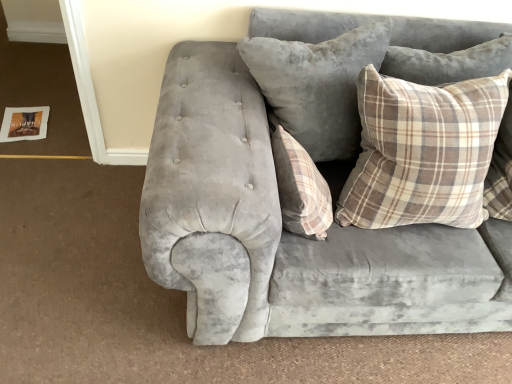
Question: Is plaid fabric pillow at upper right, positioned as the first pillow in right-to-left order, to the right of velvet gray pillow at center, positioned as the second pillow in right-to-left order, from the viewer's perspective?

Choices:
 (A) yes
 (B) no

Answer: (A)

Question: Does plaid fabric pillow at upper right, positioned as the first pillow in right-to-left order, have a greater height compared to velvet gray pillow at center, which appears as the 2th pillow when viewed from the left?

Choices:
 (A) no
 (B) yes

Answer: (A)

Question: Is plaid fabric pillow at upper right, positioned as the first pillow in right-to-left order, turned away from velvet gray pillow at center, which appears as the 2th pillow when viewed from the left?

Choices:
 (A) yes
 (B) no

Answer: (B)

Question: Considering the relative positions of plaid fabric pillow at upper right, positioned as the first pillow in right-to-left order, and velvet gray pillow at center, positioned as the second pillow in right-to-left order, in the image provided, is plaid fabric pillow at upper right, positioned as the first pillow in right-to-left order, in front of velvet gray pillow at center, positioned as the second pillow in right-to-left order,?

Choices:
 (A) yes
 (B) no

Answer: (A)

Question: Is the depth of plaid fabric pillow at upper right, positioned as the first pillow in right-to-left order, greater than that of velvet gray pillow at center, positioned as the second pillow in right-to-left order?

Choices:
 (A) no
 (B) yes

Answer: (A)

Question: Is plaid fabric pillow at center, acting as the 1th pillow starting from the left, spatially inside velvet gray couch at center, or outside of it?

Choices:
 (A) inside
 (B) outside

Answer: (A)

Question: Based on their sizes in the image, would you say plaid fabric pillow at center, acting as the 1th pillow starting from the left, is bigger or smaller than velvet gray couch at center?

Choices:
 (A) small
 (B) big

Answer: (A)

Question: Considering their positions, is plaid fabric pillow at center, marked as the 3th pillow in a right-to-left arrangement, located in front of or behind velvet gray couch at center?

Choices:
 (A) behind
 (B) front

Answer: (A)

Question: In terms of width, does plaid fabric pillow at center, marked as the 3th pillow in a right-to-left arrangement, look wider or thinner when compared to velvet gray couch at center?

Choices:
 (A) thin
 (B) wide

Answer: (A)

Question: Looking at the image, does velvet gray pillow at center, positioned as the second pillow in right-to-left order, seem bigger or smaller compared to velvet gray couch at center?

Choices:
 (A) small
 (B) big

Answer: (A)

Question: From a real-world perspective, is velvet gray pillow at center, which appears as the 2th pillow when viewed from the left, positioned above or below velvet gray couch at center?

Choices:
 (A) above
 (B) below

Answer: (A)

Question: In terms of height, does velvet gray pillow at center, which appears as the 2th pillow when viewed from the left, look taller or shorter compared to velvet gray couch at center?

Choices:
 (A) short
 (B) tall

Answer: (A)

Question: Considering the positions of velvet gray pillow at center, positioned as the second pillow in right-to-left order, and velvet gray couch at center in the image, is velvet gray pillow at center, positioned as the second pillow in right-to-left order, wider or thinner than velvet gray couch at center?

Choices:
 (A) thin
 (B) wide

Answer: (A)

Question: Relative to plaid fabric pillow at upper right, positioned as the first pillow in right-to-left order, is velvet gray couch at center in front or behind?

Choices:
 (A) behind
 (B) front

Answer: (B)

Question: From a real-world perspective, is velvet gray couch at center positioned above or below plaid fabric pillow at upper right, positioned as the first pillow in right-to-left order?

Choices:
 (A) above
 (B) below

Answer: (B)